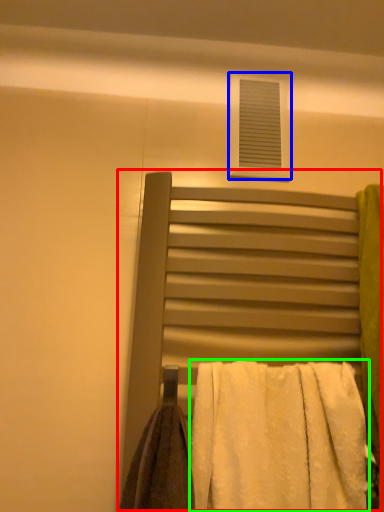
Question: Which is farther away from bed (highlighted by a red box)? window (highlighted by a blue box) or towel (highlighted by a green box)?

Choices:
 (A) window
 (B) towel

Answer: (A)